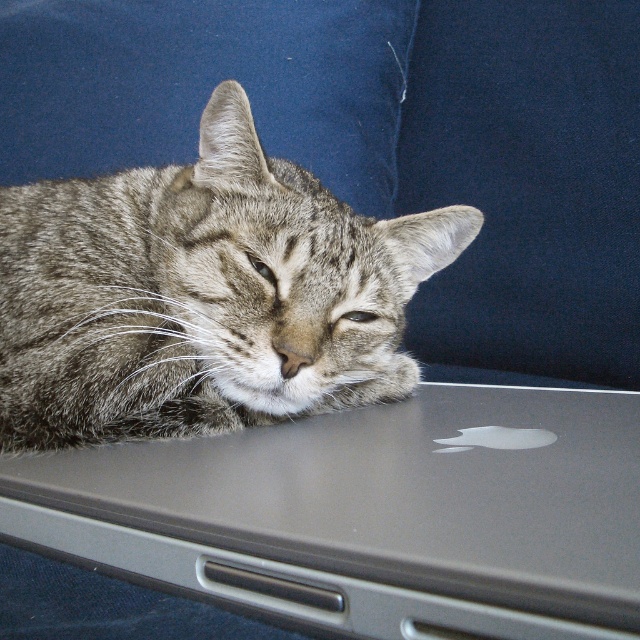
You want to place a new keyboard on the desk next to the satin silver laptop at upper center and the gray tabby cat at center. Based on their sizes, which object should you consider moving first to make space?

The satin silver laptop at upper center might be wider than the gray tabby cat at center, so you should move the laptop first to make more space for the keyboard.

You are a photographer trying to capture a clear photo of the satin silver laptop at upper center. However, there is a gray tabby cat at center blocking your view. Can you move the cat to the side to get an unobstructed shot of the laptop?

The satin silver laptop at upper center is positioned under the gray tabby cat at center, so moving the cat to the side would allow you to see the laptop.